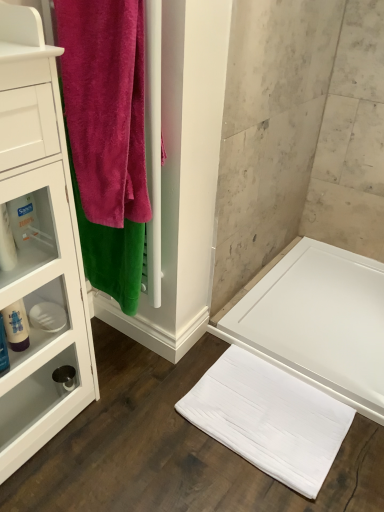
Locate an element on the screen. The height and width of the screenshot is (512, 384). unoccupied region to the right of white glossy cabinet at left is located at coordinates 118,425.